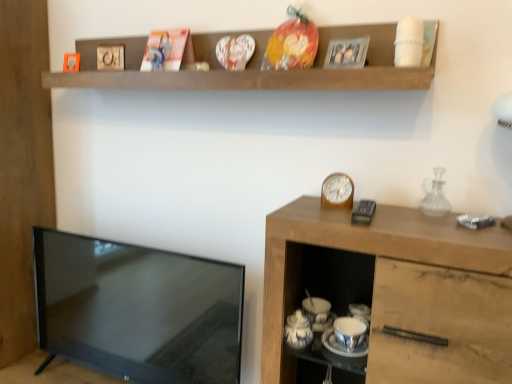
Where is `vacant area to the right of wooden clock at right`? vacant area to the right of wooden clock at right is located at coordinates (402, 215).